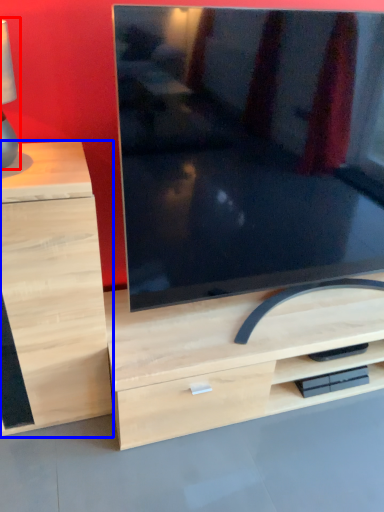
Question: Which object appears farthest to the camera in this image, table lamp (highlighted by a red box) or chest of drawers (highlighted by a blue box)?

Choices:
 (A) table lamp
 (B) chest of drawers

Answer: (B)